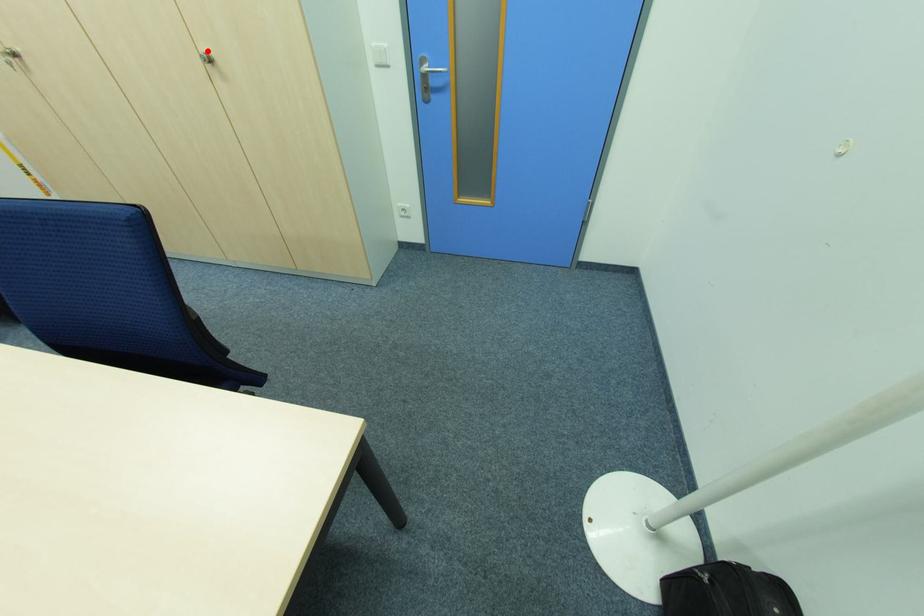
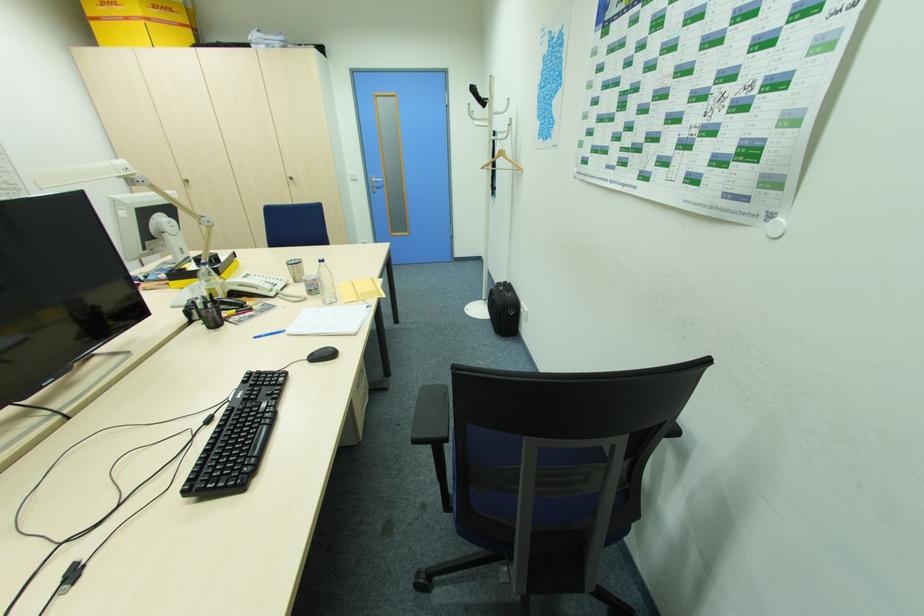
Find the pixel in the second image that matches the highlighted location in the first image.

(292, 176)